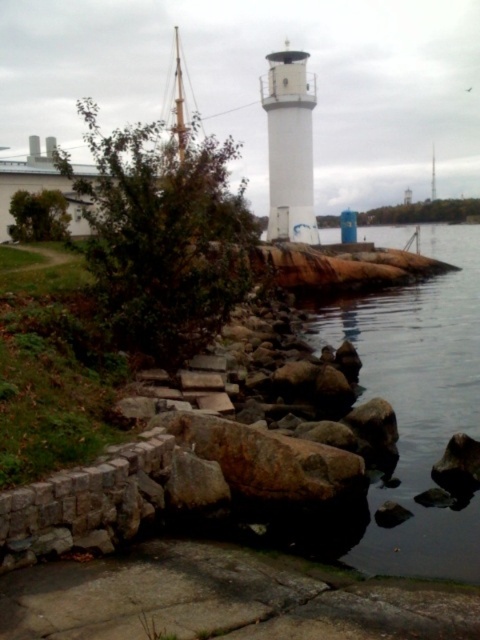
You are standing at the lighthouse and want to walk to the point marked as point (x=294, y=204). Which direction should you move relative to point (x=357, y=433)?

To reach point (x=294, y=204) from the lighthouse, you should move in the direction opposite to point (x=357, y=433) since point (x=357, y=433) is in front of point (x=294, y=204).